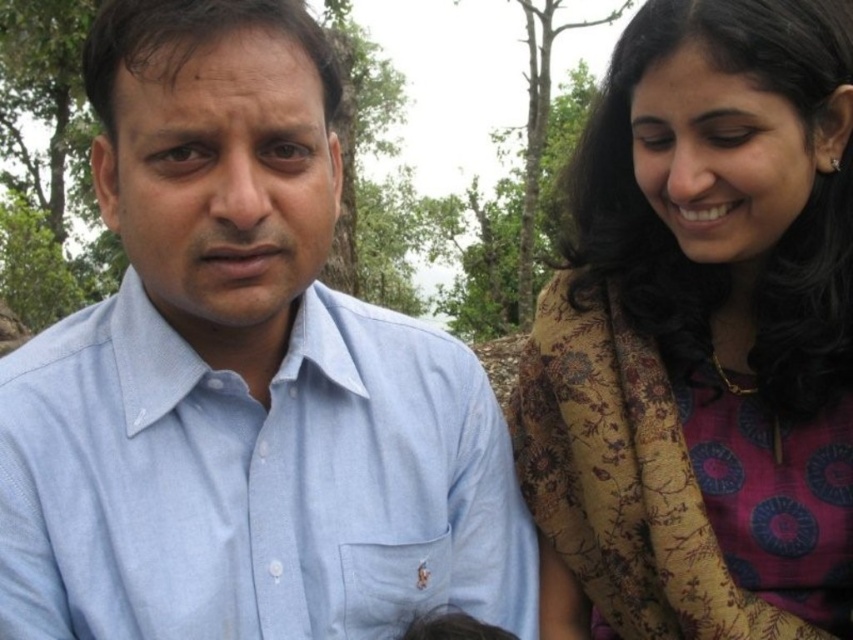
Based on the photo, who is more distant from viewer, (113,196) or (688,131)?

The point (688,131) is more distant.

Is point (173, 225) closer to camera compared to point (670, 339)?

Yes, point (173, 225) is in front of point (670, 339).

Locate an element on the screen. This screenshot has width=853, height=640. light blue cotton shirt at center is located at coordinates (241, 378).